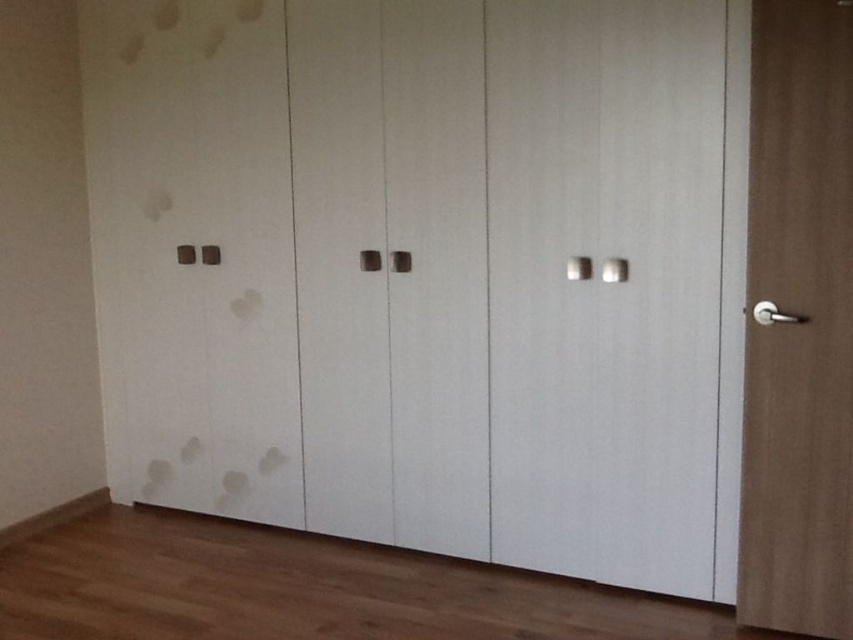
In the scene shown: You are standing in front of the wardrobe and want to open the white matte door at center and the brown wood door at right. Which door should you approach first to open them both?

You should approach the white matte door at center first because it is closer to you than the brown wood door at right, so you can open it without needing to move further back.

You are standing in front of the wardrobe and want to open the closest door. Which door should you choose between the white matte door at center and the matte white door at left?

The white matte door at center is closer to the viewer than the matte white door at left, so you should choose the white matte door at center.

You are standing in the room and notice a point marked at coordinates (605,285). Based on the scene, can you identify what object this point is located on?

The point at coordinates (605,285) is located on the white matte door at center.